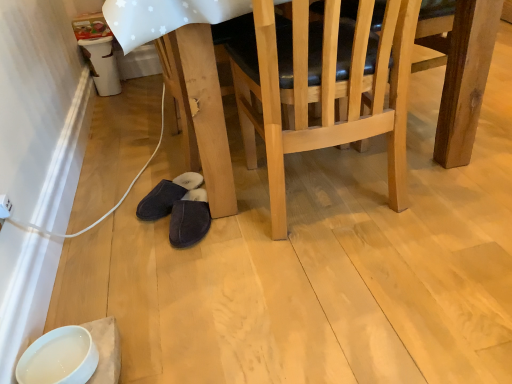
I want to click on vacant space to the left of natural wood chair at center, so click(193, 263).